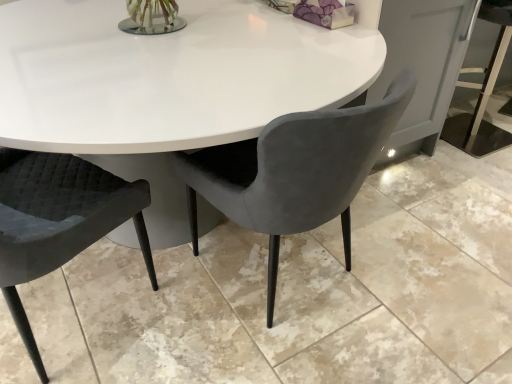
What are the coordinates of `vacant space in quilted black chair at lower left, which is the 2th chair from right to left (from a real-world perspective)` in the screenshot? It's located at point(70,307).